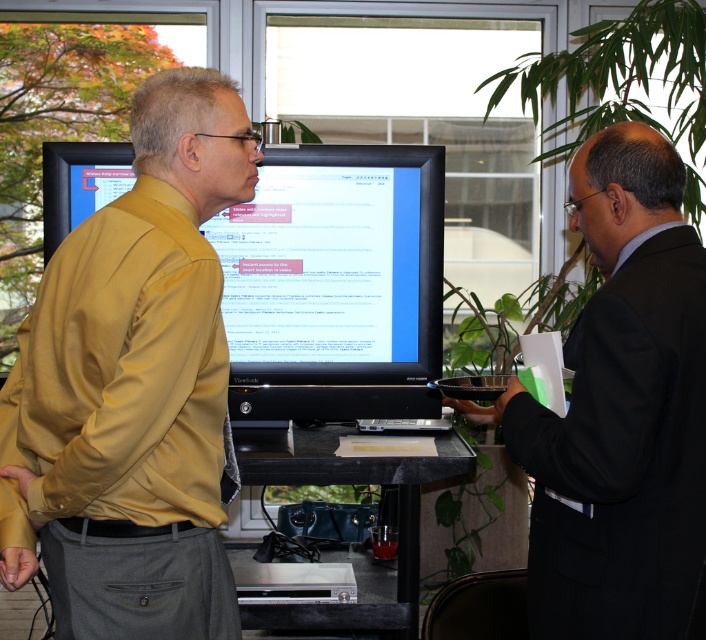
You are standing in front of the monitor and want to hand a document to the person in the black suit at right. Which direction should you move to approach them?

The black suit at right is located at point (621, 410), so you should move to the right and slightly downward to approach them.

Based on the photo, you are standing in front of the presentation monitor and want to hand a document to the person wearing the matte yellow shirt at center and the black suit at right. Which person should you approach first to ensure you can reach them without moving past the monitor?

The matte yellow shirt at center is closer to the viewer than the black suit at right, so you should approach the matte yellow shirt at center first to reach them without moving past the monitor.